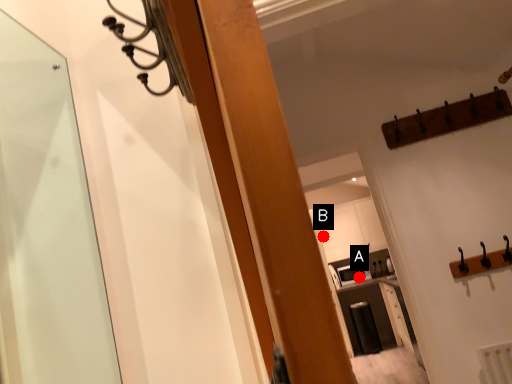
Question: Two points are circled on the image, labeled by A and B beside each circle. Which of the following is the closest to the observer?

Choices:
 (A) A is closer
 (B) B is closer

Answer: (A)